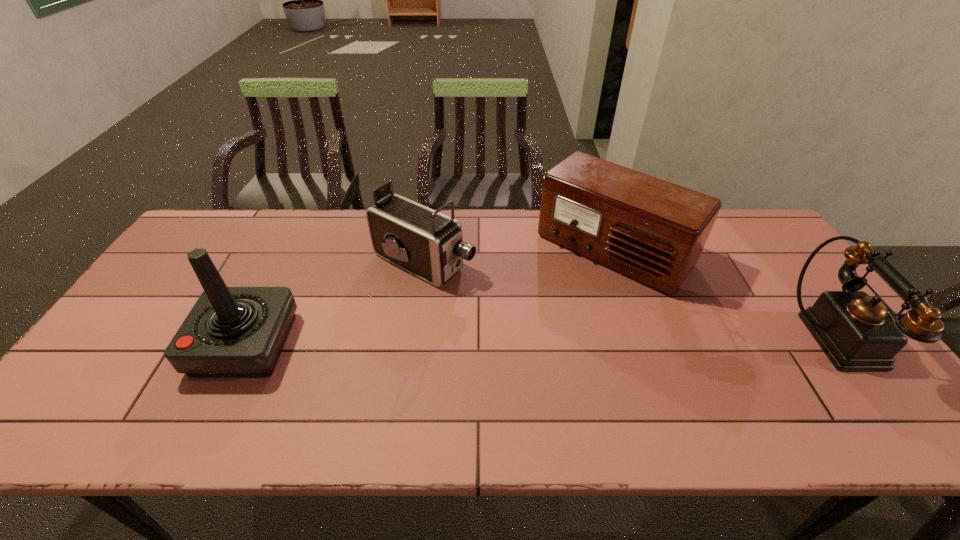
In order to click on free space on the desktop that is between the tallest object and the telephone and is positioned at the lens of the camcorder in this screenshot , I will do `click(580, 341)`.

Find the location of a particular element. free space on the desktop that is between the leftmost object and the telephone and is positioned on the front-facing side of the radio receiver is located at coordinates (527, 341).